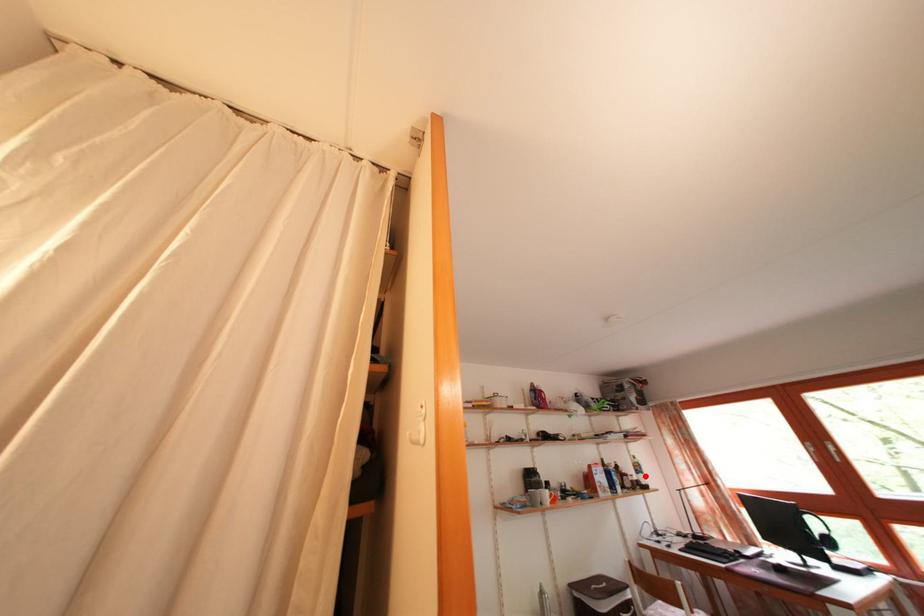
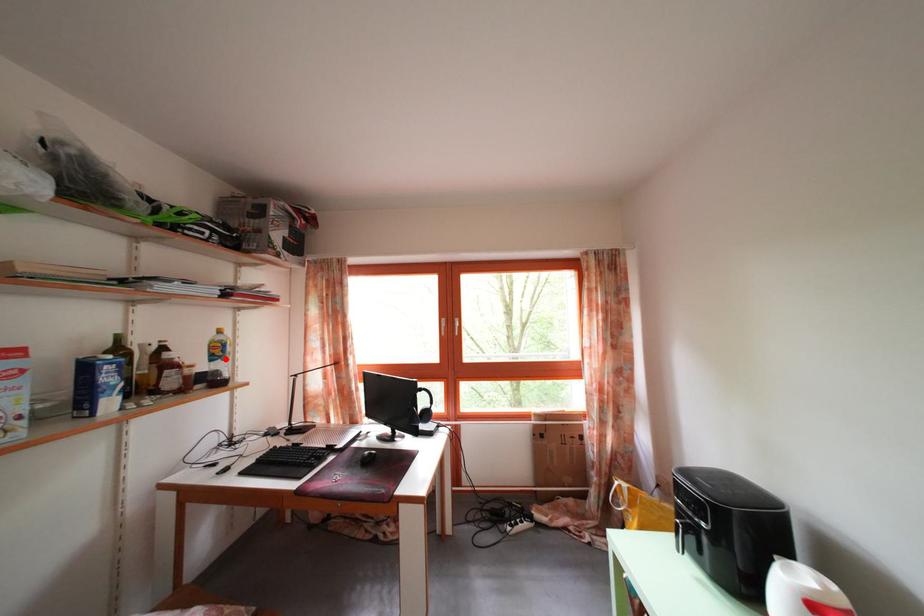
I am providing you with two images of the same scene from different viewpoints. A red point is marked on the first image and another point is marked on the second image. Do the highlighted points in image1 and image2 indicate the same real-world spot?

Yes